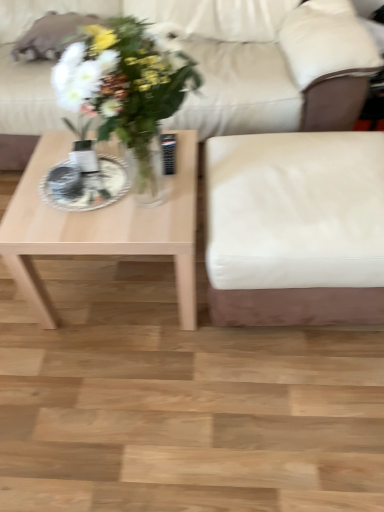
Question: Is light wood coffee table at left facing towards white leather armchair at right?

Choices:
 (A) no
 (B) yes

Answer: (A)

Question: Is light wood coffee table at left to the right of white leather armchair at right from the viewer's perspective?

Choices:
 (A) no
 (B) yes

Answer: (A)

Question: Is light wood coffee table at left facing away from white leather armchair at right?

Choices:
 (A) no
 (B) yes

Answer: (A)

Question: Can you confirm if light wood coffee table at left is thinner than white leather armchair at right?

Choices:
 (A) yes
 (B) no

Answer: (A)

Question: Is light wood coffee table at left touching white leather armchair at right?

Choices:
 (A) no
 (B) yes

Answer: (A)

Question: In the image, is white glossy plate at center on the left side or the right side of beige leather couch at center?

Choices:
 (A) right
 (B) left

Answer: (B)

Question: Considering their positions, is white glossy plate at center located in front of or behind beige leather couch at center?

Choices:
 (A) front
 (B) behind

Answer: (A)

Question: From a real-world perspective, is white glossy plate at center positioned above or below beige leather couch at center?

Choices:
 (A) above
 (B) below

Answer: (A)

Question: Is point (52, 190) positioned closer to the camera than point (48, 110)?

Choices:
 (A) closer
 (B) farther

Answer: (A)

Question: Is beige leather couch at center in front of or behind light wood coffee table at left in the image?

Choices:
 (A) behind
 (B) front

Answer: (A)

Question: In the image, is beige leather couch at center on the left side or the right side of light wood coffee table at left?

Choices:
 (A) left
 (B) right

Answer: (B)

Question: From the image's perspective, relative to light wood coffee table at left, is beige leather couch at center above or below?

Choices:
 (A) below
 (B) above

Answer: (B)

Question: Is point (193, 56) positioned closer to the camera than point (41, 214)?

Choices:
 (A) closer
 (B) farther

Answer: (B)

Question: Considering their positions, is light wood coffee table at left located in front of or behind white glossy plate at center?

Choices:
 (A) behind
 (B) front

Answer: (B)

Question: In terms of width, does light wood coffee table at left look wider or thinner when compared to white glossy plate at center?

Choices:
 (A) thin
 (B) wide

Answer: (B)